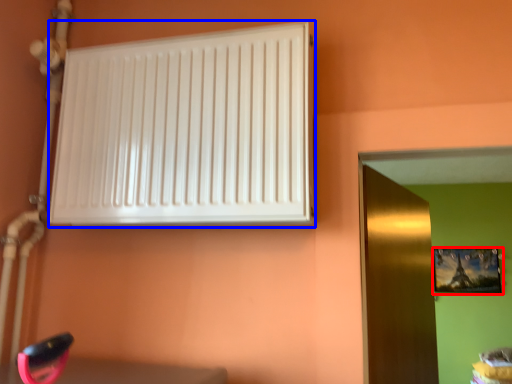
Question: Which object appears closest to the camera in this image, picture frame (highlighted by a red box) or radiator (highlighted by a blue box)?

Choices:
 (A) picture frame
 (B) radiator

Answer: (B)